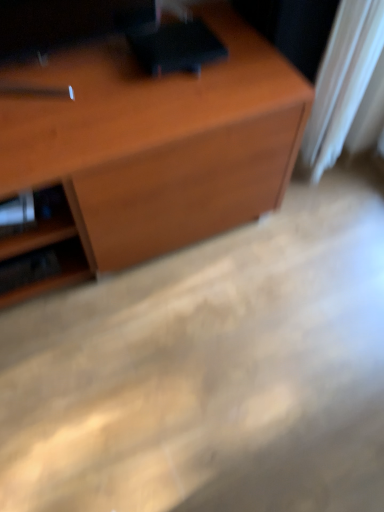
Locate an element on the screen. This screenshot has height=512, width=384. matte black shelf at lower left is located at coordinates (54, 250).

This screenshot has width=384, height=512. What do you see at coordinates (54, 250) in the screenshot?
I see `matte black shelf at lower left` at bounding box center [54, 250].

Find the location of a particular element. The width and height of the screenshot is (384, 512). matte black shelf at lower left is located at coordinates (54, 250).